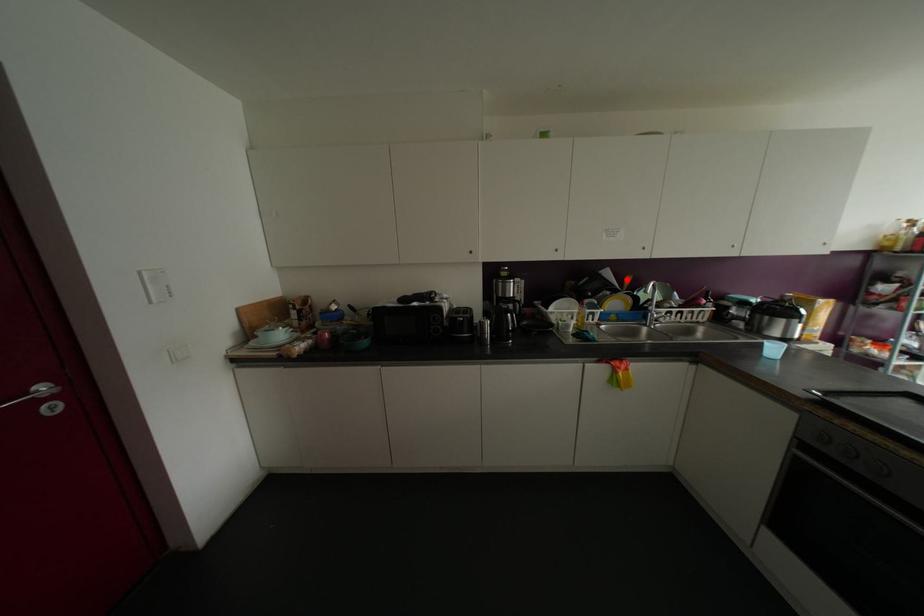
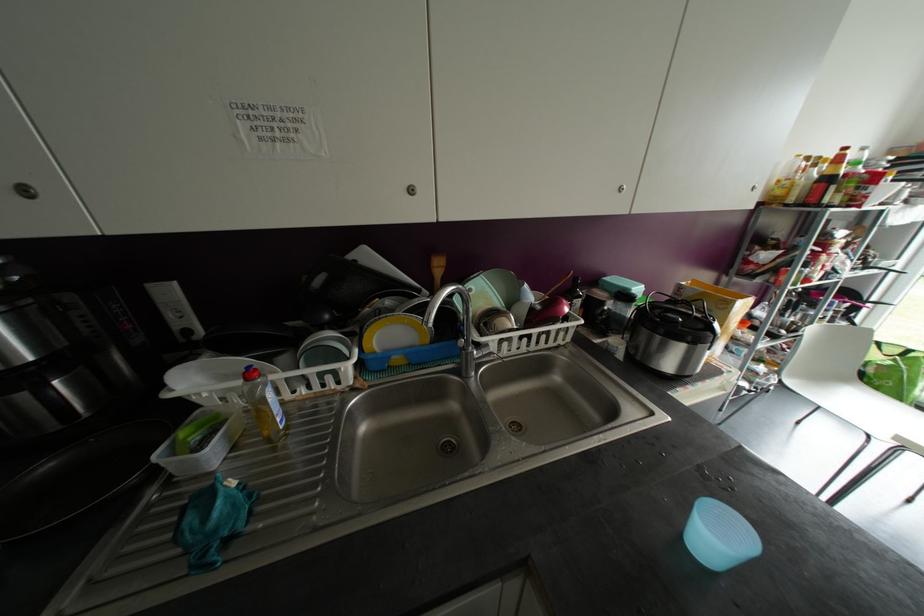
In the second image, find the point that corresponds to the highlighted location in the first image.

(438, 265)